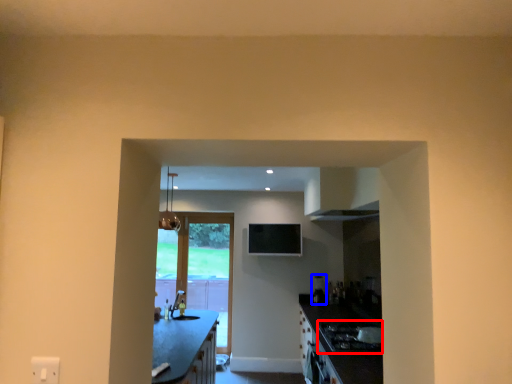
Question: Which object appears farthest to the camera in this image, gas stove (highlighted by a red box) or appliance (highlighted by a blue box)?

Choices:
 (A) gas stove
 (B) appliance

Answer: (B)